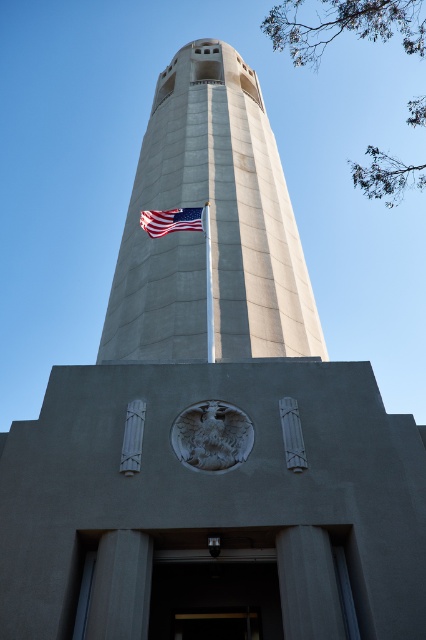
You are standing in front of the tower and want to determine which of the two points, point (131, 196) or point (203, 228), is closer to you. Based on their positions, which point is nearer?

Point (131, 196) is further to the viewer than point (203, 228), so the point closer to you is point (203, 228).

You are a photographer planning to take a photo of the concrete tower at center and the american flag at center. Based on their sizes, which object should you focus on first to ensure both are in frame without cropping?

The concrete tower at center is larger than the american flag at center, so you should focus on the concrete tower at center first to ensure it fits entirely in the frame before adjusting for the smaller american flag at center.